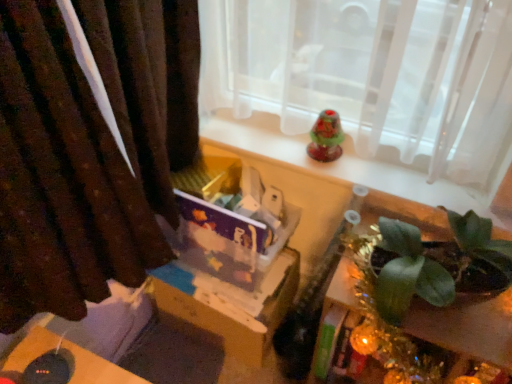
Question: Does translucent glass bell at upper center have a larger size compared to brown velvet curtain at left?

Choices:
 (A) no
 (B) yes

Answer: (A)

Question: Can brown velvet curtain at left be found inside translucent glass bell at upper center?

Choices:
 (A) yes
 (B) no

Answer: (B)

Question: Does translucent glass bell at upper center lie behind brown velvet curtain at left?

Choices:
 (A) no
 (B) yes

Answer: (B)

Question: Does translucent glass bell at upper center come in front of brown velvet curtain at left?

Choices:
 (A) no
 (B) yes

Answer: (A)

Question: Is translucent glass bell at upper center directly adjacent to brown velvet curtain at left?

Choices:
 (A) yes
 (B) no

Answer: (B)

Question: In the image, is cardboard box at center on the left side or the right side of brown velvet curtain at left?

Choices:
 (A) right
 (B) left

Answer: (A)

Question: Considering the positions of cardboard box at center and brown velvet curtain at left in the image, is cardboard box at center wider or thinner than brown velvet curtain at left?

Choices:
 (A) wide
 (B) thin

Answer: (A)

Question: Relative to brown velvet curtain at left, is cardboard box at center in front or behind?

Choices:
 (A) front
 (B) behind

Answer: (B)

Question: From a real-world perspective, relative to brown velvet curtain at left, is cardboard box at center vertically above or below?

Choices:
 (A) above
 (B) below

Answer: (B)

Question: Looking at their shapes, would you say green leafy plant at lower right is wider or thinner than brown velvet curtain at left?

Choices:
 (A) wide
 (B) thin

Answer: (A)

Question: Looking at the image, does green leafy plant at lower right seem bigger or smaller compared to brown velvet curtain at left?

Choices:
 (A) big
 (B) small

Answer: (B)

Question: From their relative heights in the image, would you say green leafy plant at lower right is taller or shorter than brown velvet curtain at left?

Choices:
 (A) tall
 (B) short

Answer: (B)

Question: Considering the positions of point (336, 278) and point (10, 109), is point (336, 278) closer or farther from the camera than point (10, 109)?

Choices:
 (A) closer
 (B) farther

Answer: (B)

Question: Visually, is translucent glass bell at upper center positioned to the left or to the right of brown velvet curtain at left?

Choices:
 (A) left
 (B) right

Answer: (B)

Question: Is point (335, 137) closer or farther from the camera than point (143, 192)?

Choices:
 (A) farther
 (B) closer

Answer: (A)